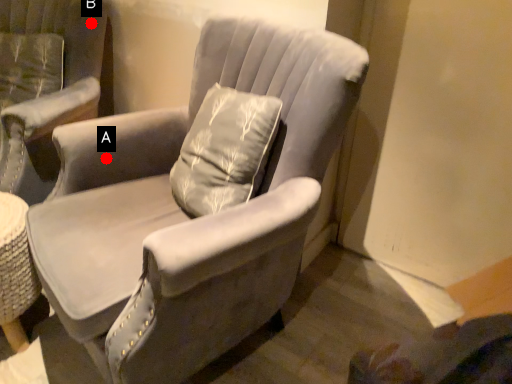
Question: Two points are circled on the image, labeled by A and B beside each circle. Which point appears closest to the camera in this image?

Choices:
 (A) A is closer
 (B) B is closer

Answer: (A)